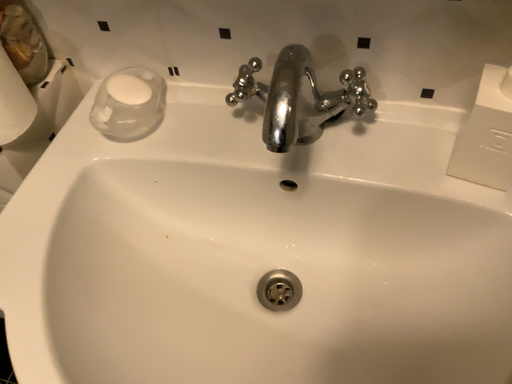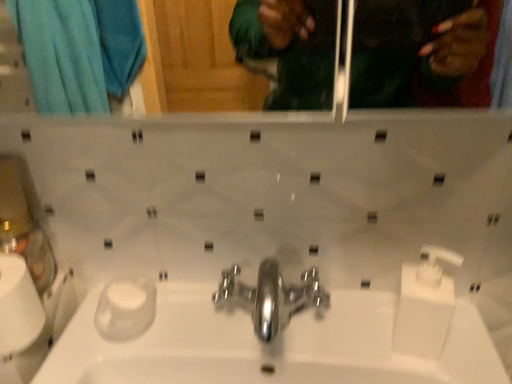
Question: How did the camera likely rotate when shooting the video?

Choices:
 (A) rotated downward
 (B) rotated upward

Answer: (B)